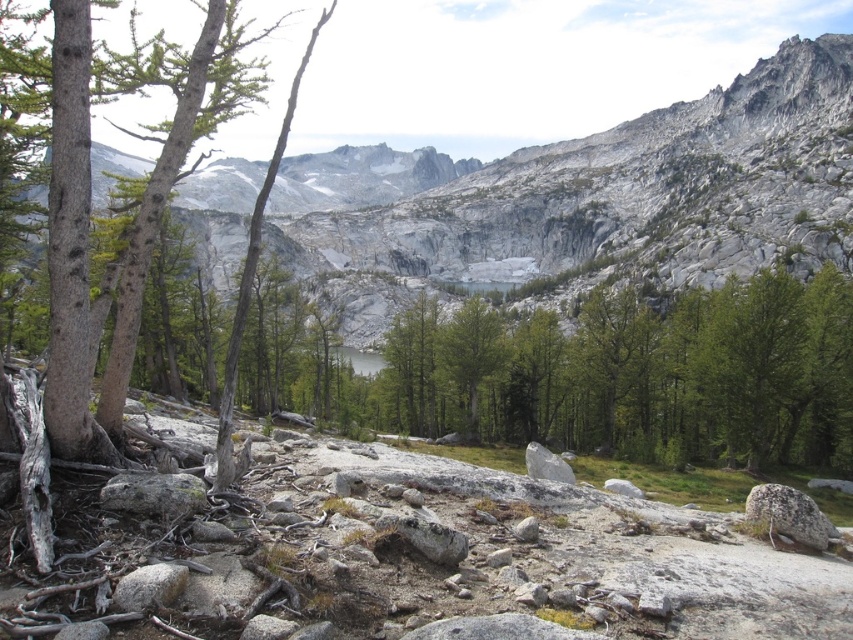
Does gray rock mountain at center have a smaller size compared to green matte tree at center?

Incorrect, gray rock mountain at center is not smaller in size than green matte tree at center.

Which of these two, gray rock mountain at center or green matte tree at center, stands taller?

gray rock mountain at center

Image resolution: width=853 pixels, height=640 pixels. In order to click on gray rock mountain at center in this screenshot , I will do `click(606, 192)`.

Is the position of smooth gray bark tree at left less distant than that of green matte tree at center?

Yes, smooth gray bark tree at left is closer to the viewer.

Is smooth gray bark tree at left shorter than green matte tree at center?

No, smooth gray bark tree at left is not shorter than green matte tree at center.

In order to click on smooth gray bark tree at left in this screenshot , I will do `click(86, 234)`.

Identify the location of smooth gray bark tree at left. Image resolution: width=853 pixels, height=640 pixels. (86, 234).

Does gray rock mountain at center appear on the left side of smooth gray bark tree at left?

No, gray rock mountain at center is not to the left of smooth gray bark tree at left.

The width and height of the screenshot is (853, 640). I want to click on gray rock mountain at center, so click(606, 192).